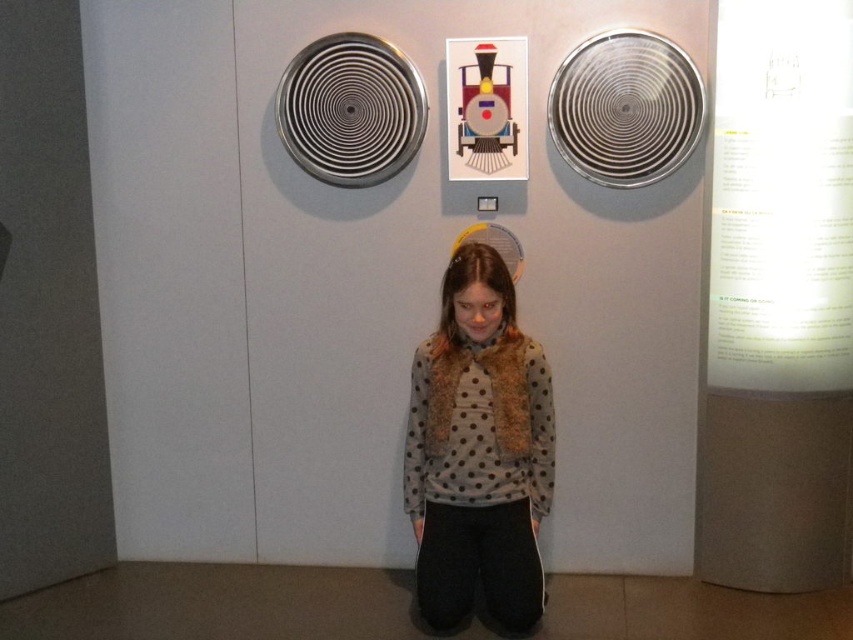
You are an art installer who needs to place a new sculpture exactly halfway between the metallic spiral fan at upper right and the metallic train at upper center. The sculpture is 3 inches wide. Will it fit without overlapping either object?

The distance between the metallic spiral fan at upper right and the metallic train at upper center is 11.41 inches. Half of this distance is approximately 5.7 inches. Since the sculpture is only 3 inches wide, placing it halfway would leave enough space on both sides, so yes, it will fit without overlapping either object.

In the scene shown: You are standing at point A located at coordinates point A at (x=692, y=70). You want to walk to point B located at coordinates point B at 0.333, 0.666. The path between them is 8.90 feet. If your stride length is 2.5 feet, how many steps will it take you to reach point B?

The distance between point A at (x=692, y=70) and point B at 0.333, 0.666 is 8.90 feet. With a stride length of 2.5 feet, you would need approximately 4 steps to cover the distance, as 8.90 divided by 2.5 equals roughly 3.56, which rounds up to 4 steps.

You are standing in the museum and want to take a photo of the metallic spiral fan at upper right. If your camera can focus on objects up to 10 feet away, will you be able to take a clear photo?

The metallic spiral fan at upper right is 8.85 feet away from the viewer, which is within the camera focus range of up to 10 feet. Therefore, you can take a clear photo.